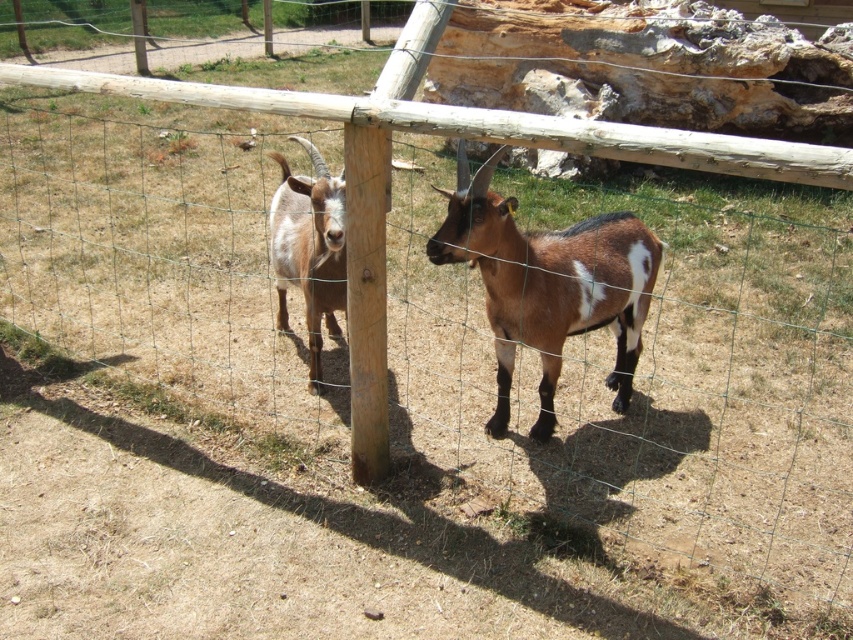
Is brown fuzzy goat at center to the right of white fur goat at center from the viewer's perspective?

Correct, you'll find brown fuzzy goat at center to the right of white fur goat at center.

Does brown fuzzy goat at center have a larger size compared to white fur goat at center?

Correct, brown fuzzy goat at center is larger in size than white fur goat at center.

The width and height of the screenshot is (853, 640). I want to click on brown fuzzy goat at center, so click(548, 284).